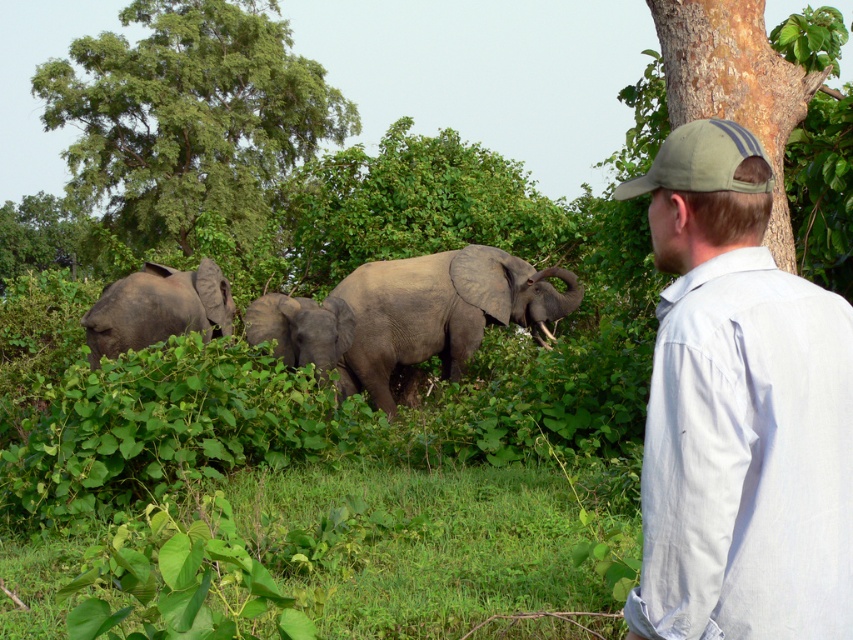
You are standing at the point marked as point (502, 264) in the image. The elephants are located 41.58 feet away from you. If you want to take a photo of the elephants without getting closer than 40 feet for safety, is your current position suitable?

The distance of point (502, 264) from viewer is 41.58 feet, so yes, your current position is suitable because you are more than 40 feet away from the elephants, which meets the safety requirement.

You are a wildlife photographer positioned at the man in the scene. You want to capture a photo that includes both the light gray cotton shirt at upper right and the gray matte elephant at left. Which object should you pan your camera towards first to frame both in the shot?

You should pan your camera towards the gray matte elephant at left first because the light gray cotton shirt at upper right is to the right of it, so starting with the leftmost object ensures both can be included in the frame.